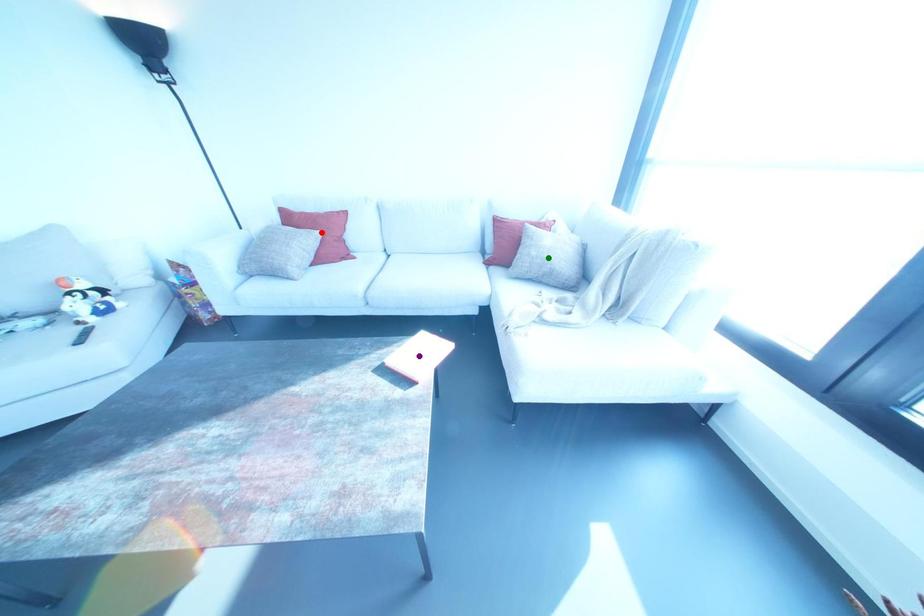
Looking at this image, order these from nearest to farthest:
purple point, red point, green point

1. red point
2. green point
3. purple point